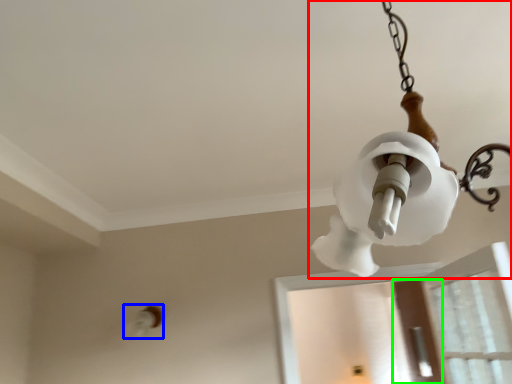
Question: Which object is the closest to the lamp (highlighted by a red box)? Choose among these: light fixture (highlighted by a blue box) or screen door (highlighted by a green box).

Choices:
 (A) light fixture
 (B) screen door

Answer: (A)